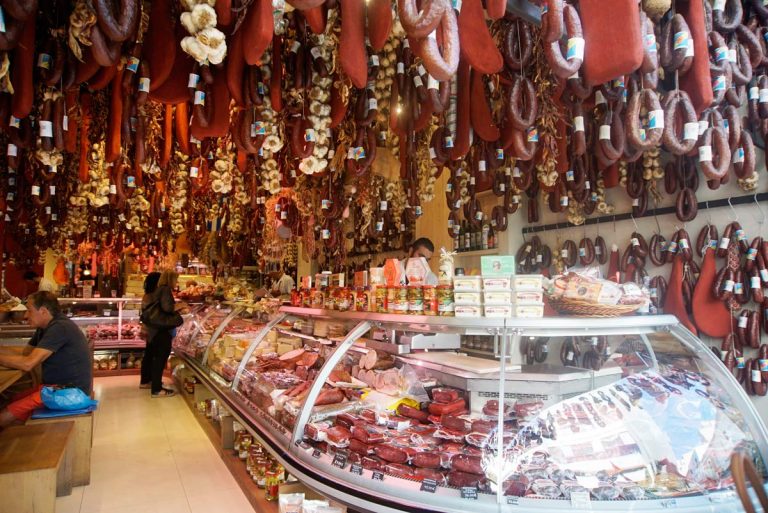
Locate an element on the screen. The height and width of the screenshot is (513, 768). display case is located at coordinates pos(593,374), pos(445,367), pos(306,356), pos(226,321).